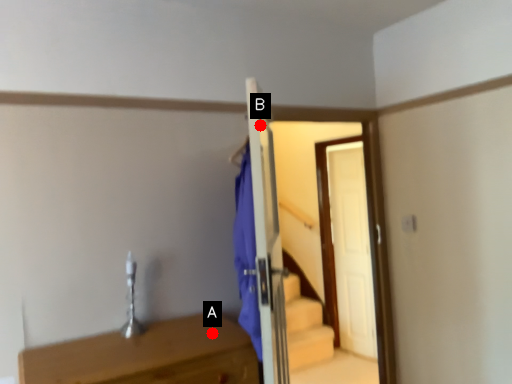
Question: Two points are circled on the image, labeled by A and B beside each circle. Which point appears farthest from the camera in this image?

Choices:
 (A) A is further
 (B) B is further

Answer: (A)